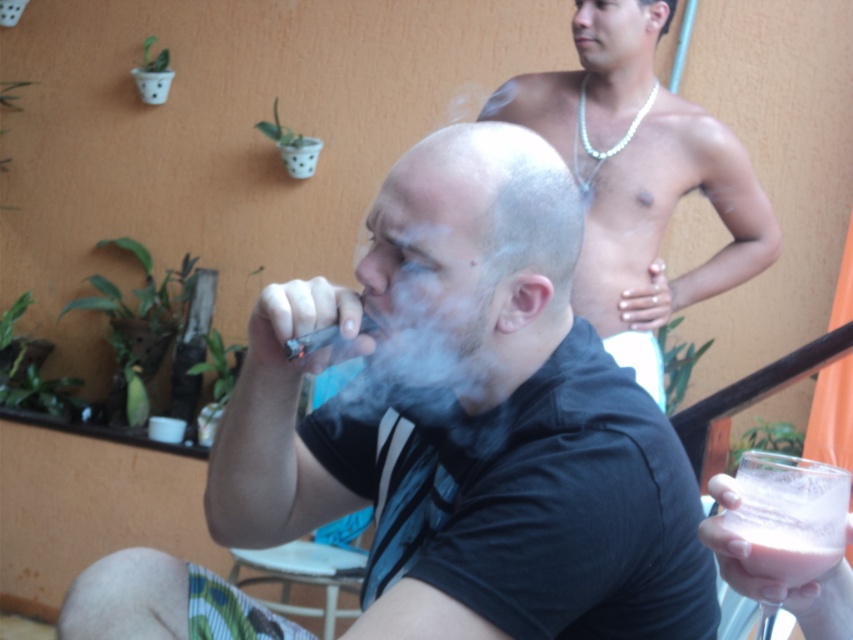
From the picture: Does shiny silver necklace at upper right have a larger size compared to milky white liquid at lower right?

Indeed, shiny silver necklace at upper right has a larger size compared to milky white liquid at lower right.

Is shiny silver necklace at upper right closer to the viewer compared to milky white liquid at lower right?

No, it is behind milky white liquid at lower right.

Which is behind, point (717, 253) or point (833, 548)?

The point (717, 253) is behind.

The width and height of the screenshot is (853, 640). What are the coordinates of `shiny silver necklace at upper right` in the screenshot? It's located at (639, 168).

Can you confirm if black matte shirt at center is shorter than milky white liquid at lower right?

No.

Describe the element at coordinates (469, 420) in the screenshot. I see `black matte shirt at center` at that location.

This screenshot has height=640, width=853. In order to click on black matte shirt at center in this screenshot , I will do `click(469, 420)`.

Which is more to the left, white vapor at center or milky white liquid at lower right?

Positioned to the left is white vapor at center.

Locate an element on the screen. The width and height of the screenshot is (853, 640). white vapor at center is located at coordinates [425, 353].

What do you see at coordinates (425, 353) in the screenshot?
I see `white vapor at center` at bounding box center [425, 353].

Image resolution: width=853 pixels, height=640 pixels. Identify the location of white vapor at center. 425,353.